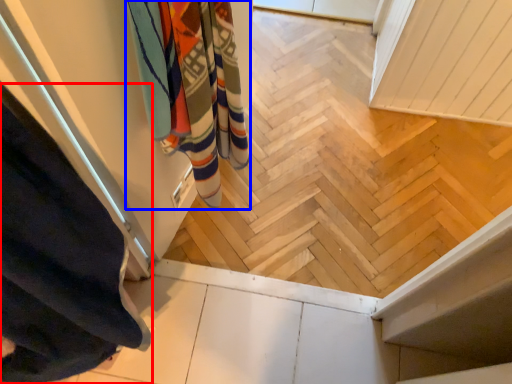
Question: Which of the following is the farthest to the observer, curtain (highlighted by a red box) or bath towel (highlighted by a blue box)?

Choices:
 (A) curtain
 (B) bath towel

Answer: (B)